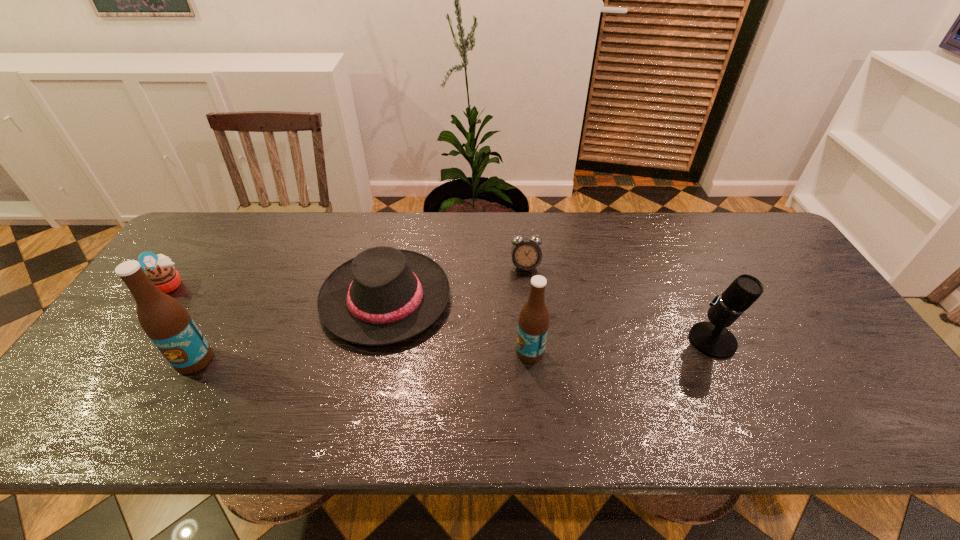
Where is `the taller beer bottle`? the taller beer bottle is located at coordinates (166, 322).

The image size is (960, 540). In order to click on the tallest object in this screenshot , I will do `click(166, 322)`.

This screenshot has width=960, height=540. What are the coordinates of `the right beer bottle` in the screenshot? It's located at (533, 323).

Locate an element on the screen. The width and height of the screenshot is (960, 540). the fourth object from right to left is located at coordinates 384,295.

You are a GUI agent. You are given a task and a screenshot of the screen. Output one action in this format:
    pyautogui.click(x=<x>, y=<y>)
    Task: Click on the microphone
    This screenshot has height=540, width=960.
    Given the screenshot: What is the action you would take?
    pyautogui.click(x=713, y=339)

What are the coordinates of `the rightmost object` in the screenshot? It's located at (713, 339).

This screenshot has height=540, width=960. Identify the location of alarm clock. click(x=526, y=255).

Where is `muffin`? This screenshot has width=960, height=540. muffin is located at coordinates [x=160, y=270].

Where is `free space located on the back of the left beer bottle`? free space located on the back of the left beer bottle is located at coordinates (250, 261).

Locate an element on the screen. The width and height of the screenshot is (960, 540). free space located 0.290m on the left of the right beer bottle is located at coordinates (399, 352).